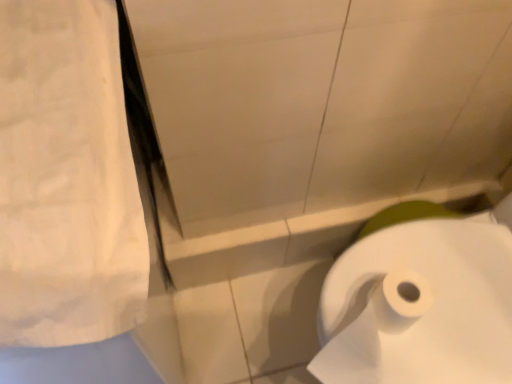
Question: Is white cotton towel at upper left surrounded by white paper at lower right?

Choices:
 (A) no
 (B) yes

Answer: (A)

Question: Is there a large distance between white paper at lower right and white cotton towel at upper left?

Choices:
 (A) no
 (B) yes

Answer: (A)

Question: Is white paper at lower right smaller than white cotton towel at upper left?

Choices:
 (A) yes
 (B) no

Answer: (A)

Question: Considering the relative positions of white paper at lower right and white cotton towel at upper left in the image provided, is white paper at lower right to the left of white cotton towel at upper left from the viewer's perspective?

Choices:
 (A) no
 (B) yes

Answer: (A)

Question: Can you confirm if white paper at lower right is taller than white cotton towel at upper left?

Choices:
 (A) no
 (B) yes

Answer: (B)

Question: Is white paper at lower right further to the viewer compared to white cotton towel at upper left?

Choices:
 (A) no
 (B) yes

Answer: (B)

Question: Is white cotton towel at upper left turned away from white paper at lower right?

Choices:
 (A) yes
 (B) no

Answer: (B)

Question: Does white cotton towel at upper left have a lesser width compared to white paper at lower right?

Choices:
 (A) no
 (B) yes

Answer: (A)

Question: Does white cotton towel at upper left come in front of white paper at lower right?

Choices:
 (A) yes
 (B) no

Answer: (A)

Question: From a real-world perspective, does white cotton towel at upper left stand above white paper at lower right?

Choices:
 (A) no
 (B) yes

Answer: (B)

Question: Considering the relative sizes of white cotton towel at upper left and white paper at lower right in the image provided, is white cotton towel at upper left wider than white paper at lower right?

Choices:
 (A) no
 (B) yes

Answer: (B)

Question: Is white cotton towel at upper left shorter than white paper at lower right?

Choices:
 (A) yes
 (B) no

Answer: (A)

Question: Do you think white cotton towel at upper left is within white paper at lower right, or outside of it?

Choices:
 (A) outside
 (B) inside

Answer: (A)